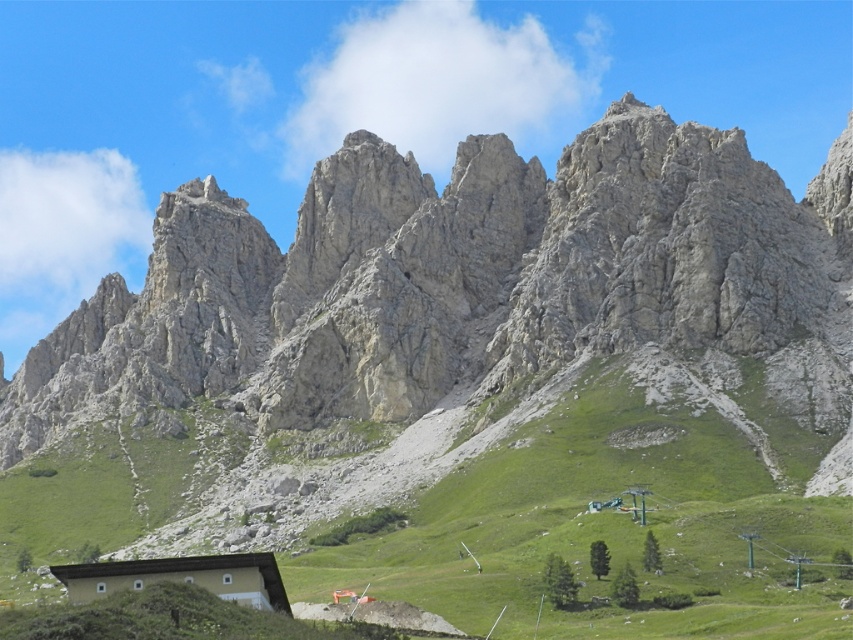
Who is higher up, green grassy slope at center or light brown wooden hut at lower center?

green grassy slope at center is above.

Does green grassy slope at center appear under light brown wooden hut at lower center?

No, green grassy slope at center is not below light brown wooden hut at lower center.

Which is behind, point (444, 554) or point (251, 557)?

The point (444, 554) is more distant.

Where is `green grassy slope at center`? The height and width of the screenshot is (640, 853). green grassy slope at center is located at coordinates (613, 513).